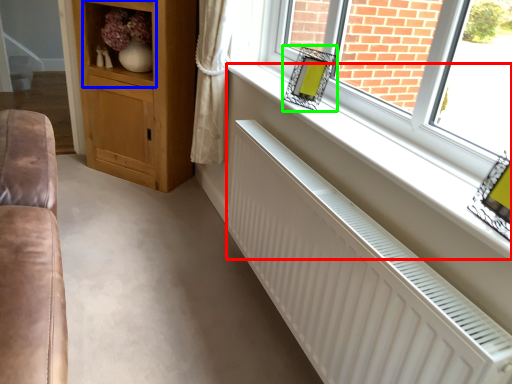
Question: Which object is the farthest from window sill (highlighted by a red box)? Choose among these: shelf (highlighted by a blue box) or picture frame (highlighted by a green box).

Choices:
 (A) shelf
 (B) picture frame

Answer: (A)